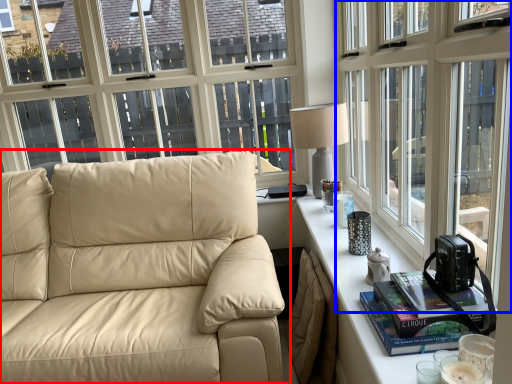
Question: Among these objects, which one is farthest to the camera, studio couch (highlighted by a red box) or window (highlighted by a blue box)?

Choices:
 (A) studio couch
 (B) window

Answer: (A)